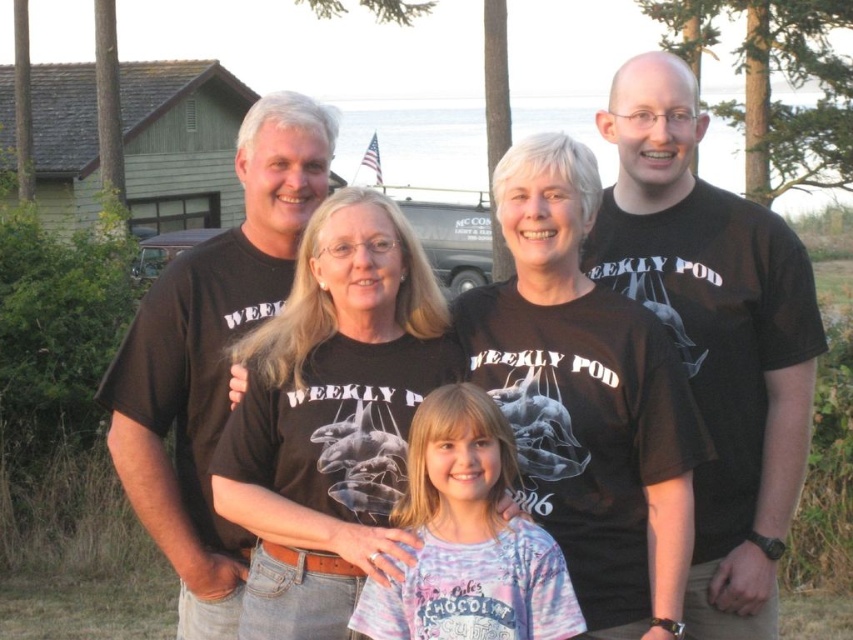
Question: Can you confirm if black matte t-shirt at center is positioned below tie-dye fabric shirt at center?

Choices:
 (A) yes
 (B) no

Answer: (B)

Question: Is black cotton t-shirt at upper left further to camera compared to tie-dye fabric shirt at center?

Choices:
 (A) no
 (B) yes

Answer: (B)

Question: Which point appears farthest from the camera in this image?

Choices:
 (A) (x=440, y=364)
 (B) (x=223, y=534)
 (C) (x=370, y=618)

Answer: (B)

Question: Which of these objects is positioned farthest from the tie-dye fabric shirt at center?

Choices:
 (A) black cotton t-shirt at upper left
 (B) black matte t-shirt at center

Answer: (A)

Question: Can you confirm if black matte t-shirt at center is positioned to the right of black cotton t-shirt at upper left?

Choices:
 (A) no
 (B) yes

Answer: (B)

Question: Which object is positioned farthest from the black cotton t-shirt at upper left?

Choices:
 (A) black matte t-shirt at center
 (B) tie-dye fabric shirt at center

Answer: (B)